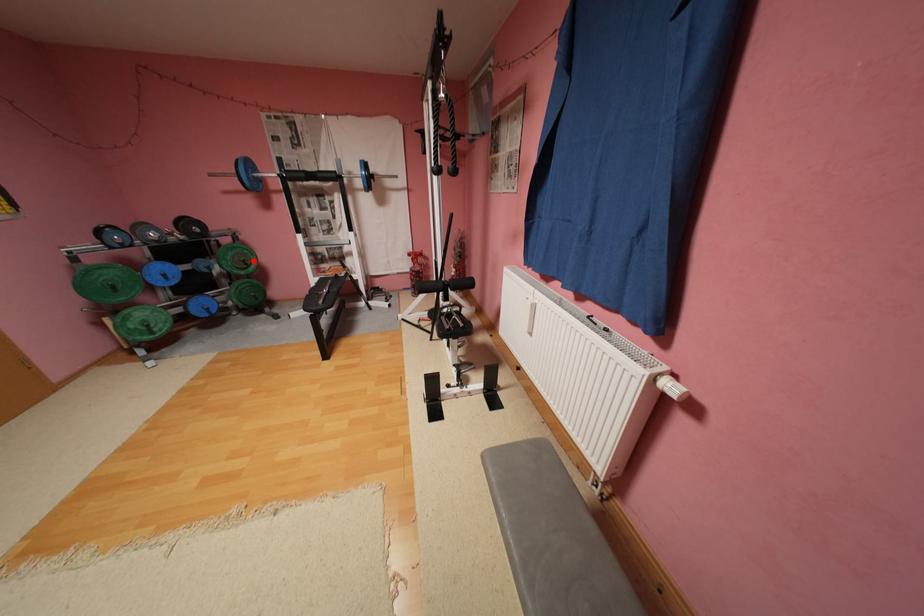
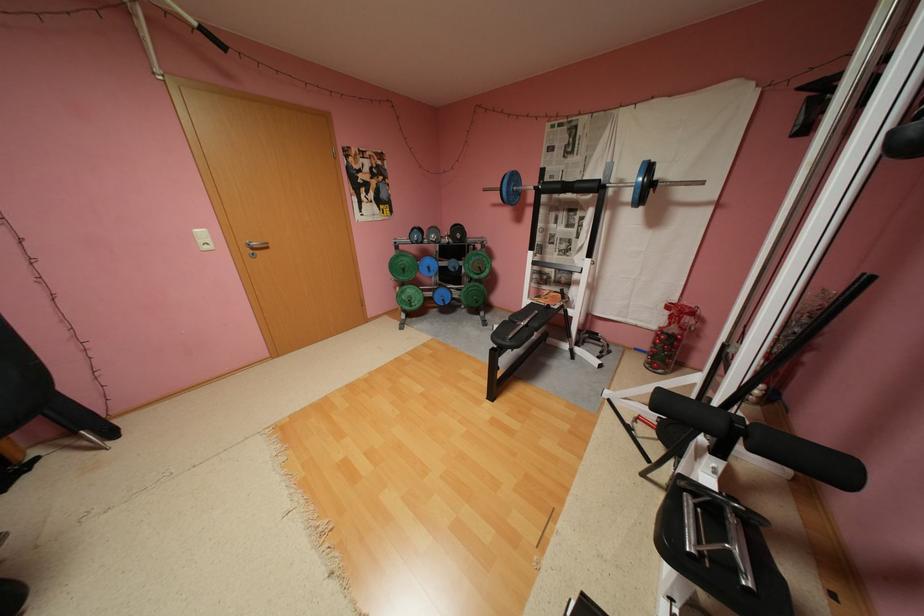
The point at the highlighted location is marked in the first image. Where is the corresponding point in the second image?

(489, 267)